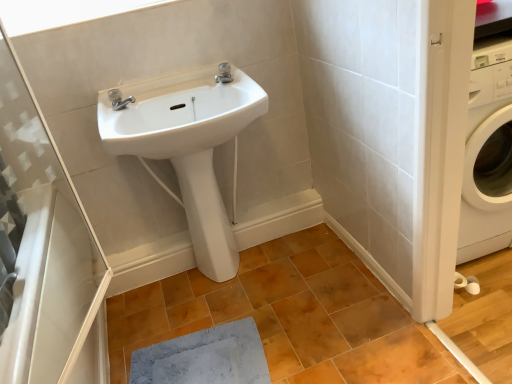
Where is `vacant space situated above white matte window at upper left (from a real-world perspective)`? The image size is (512, 384). vacant space situated above white matte window at upper left (from a real-world perspective) is located at coordinates (88, 12).